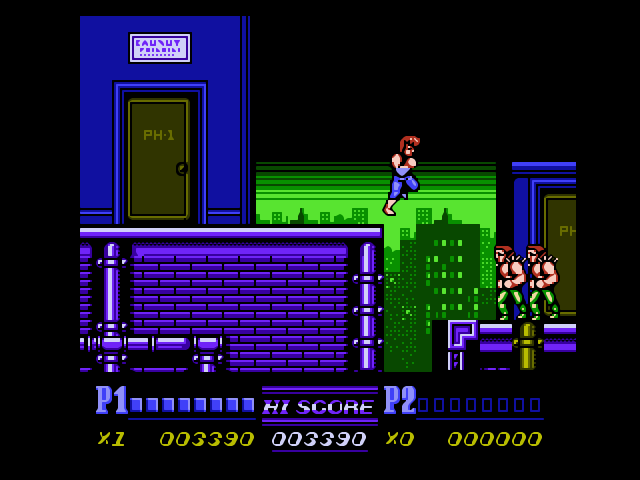
The height and width of the screenshot is (480, 640). Find the location of `door handle`. door handle is located at coordinates (182, 166).